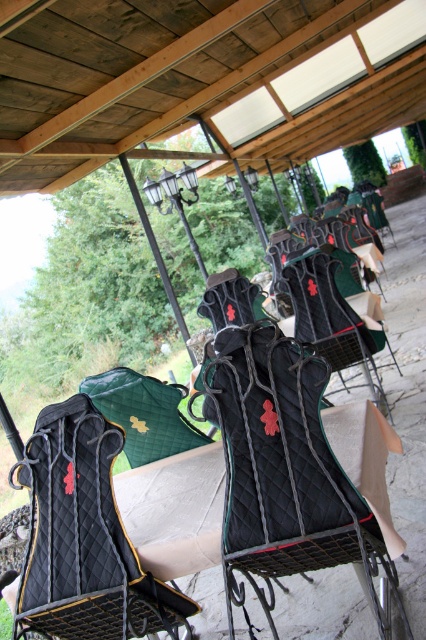
Which of these two, black quilted folding chair at center or quilted black chair at center, stands taller?

Standing taller between the two is quilted black chair at center.

Who is positioned more to the right, black quilted folding chair at center or quilted black chair at center?

Positioned to the right is quilted black chair at center.

The height and width of the screenshot is (640, 426). Identify the location of black quilted folding chair at center. (83, 538).

Is point (193, 518) farther from viewer compared to point (305, 292)?

No.

Who is shorter, black quilted table at center or quilted black chair at center?

With less height is black quilted table at center.

What do you see at coordinates (175, 509) in the screenshot? This screenshot has width=426, height=640. I see `black quilted table at center` at bounding box center [175, 509].

Where is `black quilted table at center`? black quilted table at center is located at coordinates click(x=175, y=509).

Between point (95, 524) and point (195, 552), which one is positioned behind?

Positioned behind is point (95, 524).

Does black quilted folding chair at center appear on the right side of black quilted table at center?

No, black quilted folding chair at center is not to the right of black quilted table at center.

At what (x,y) coordinates should I click in order to perform the action: click on black quilted folding chair at center. Please return your answer as a coordinate pair (x, y). Looking at the image, I should click on (83, 538).